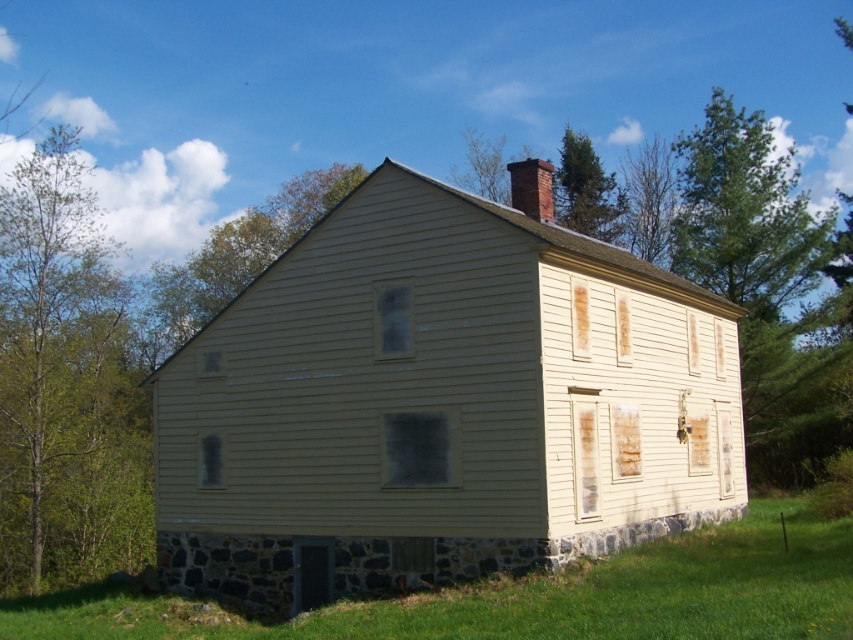
Question: Which point is farther to the camera?

Choices:
 (A) (503, 196)
 (B) (824, 552)
 (C) (666, 250)
 (D) (107, 300)

Answer: (A)

Question: Which of the following is the farthest from the observer?

Choices:
 (A) green coniferous tree at upper right
 (B) green leafy tree at upper center
 (C) smooth brown tree trunk at upper right
 (D) green leafy tree at left

Answer: (B)

Question: Is smooth brown tree trunk at upper right smaller than green coniferous tree at upper center?

Choices:
 (A) no
 (B) yes

Answer: (B)

Question: Does green leafy tree at left appear under green leafy tree at upper center?

Choices:
 (A) no
 (B) yes

Answer: (B)

Question: Observing the image, what is the correct spatial positioning of green grass at lower right in reference to green leafy tree at upper center?

Choices:
 (A) right
 (B) left

Answer: (B)

Question: Which object is positioned farthest from the green coniferous tree at upper center?

Choices:
 (A) green leafy tree at left
 (B) green coniferous tree at upper right
 (C) smooth brown tree trunk at upper right
 (D) green leafy tree at upper center

Answer: (A)